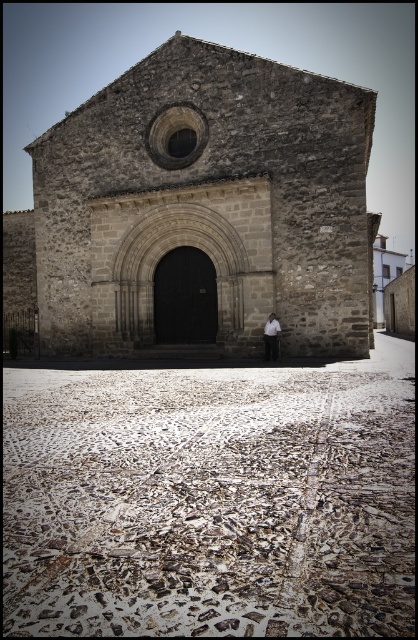
Question: Does stone textured chapel at center come in front of white cotton shirt at center?

Choices:
 (A) no
 (B) yes

Answer: (B)

Question: Is white textured cobblestone at lower center smaller than stone textured chapel at center?

Choices:
 (A) yes
 (B) no

Answer: (A)

Question: Can you confirm if stone textured chapel at center is smaller than white cotton shirt at center?

Choices:
 (A) yes
 (B) no

Answer: (B)

Question: Which point is closer to the camera?

Choices:
 (A) (270, 332)
 (B) (316, 467)
 (C) (237, 241)

Answer: (B)

Question: Among these objects, which one is farthest from the camera?

Choices:
 (A) white textured cobblestone at lower center
 (B) white cotton shirt at center

Answer: (B)

Question: Which of these objects is positioned farthest from the stone textured chapel at center?

Choices:
 (A) white cotton shirt at center
 (B) white textured cobblestone at lower center

Answer: (B)